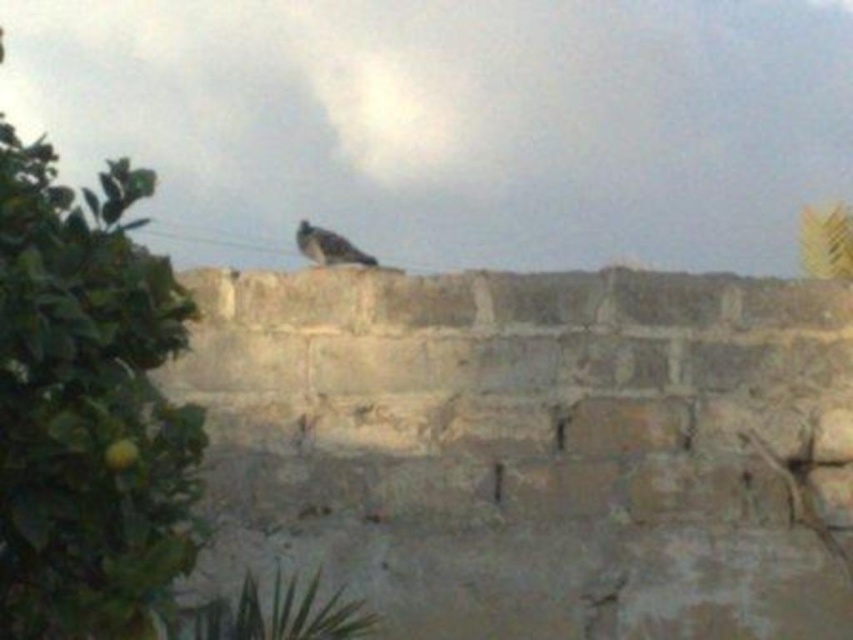
You are a painter standing in front of the stone wall. You want to paint the green leafy tree at left and the gray feathered bird at center. Which object should you focus on first if you want to paint the larger one first?

The green leafy tree at left is bigger than the gray feathered bird at center, so you should focus on painting the green leafy tree at left first.

You are standing in front of a stone wall with a bird on top. There is a green leafy tree at left. Where is the point at coordinate [86,406] located?

The point at coordinate [86,406] is located at the green leafy tree at left.